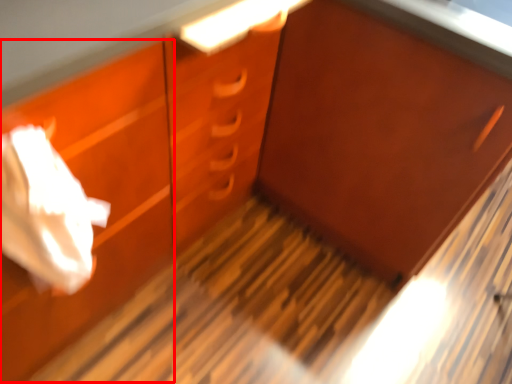
Question: Considering the relative positions of drawer (annotated by the red box) and cabinetry in the image provided, where is drawer (annotated by the red box) located with respect to the staircase?

Choices:
 (A) right
 (B) left

Answer: (B)